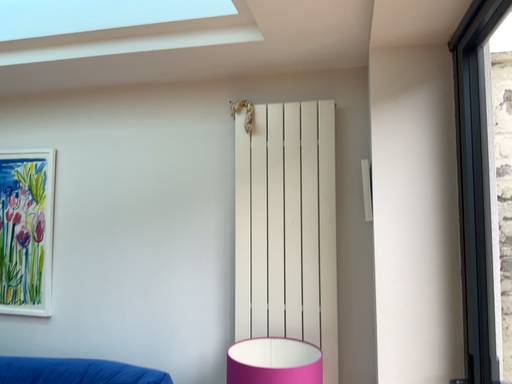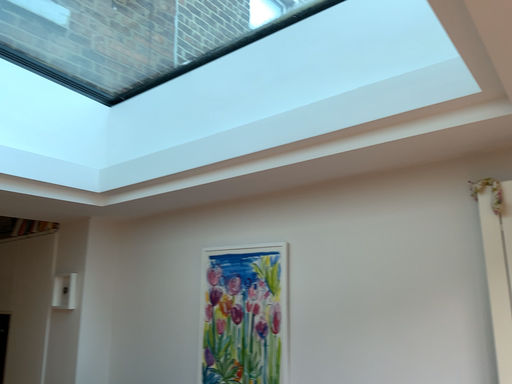
Question: Which way did the camera rotate in the video?

Choices:
 (A) rotated downward
 (B) rotated upward

Answer: (B)